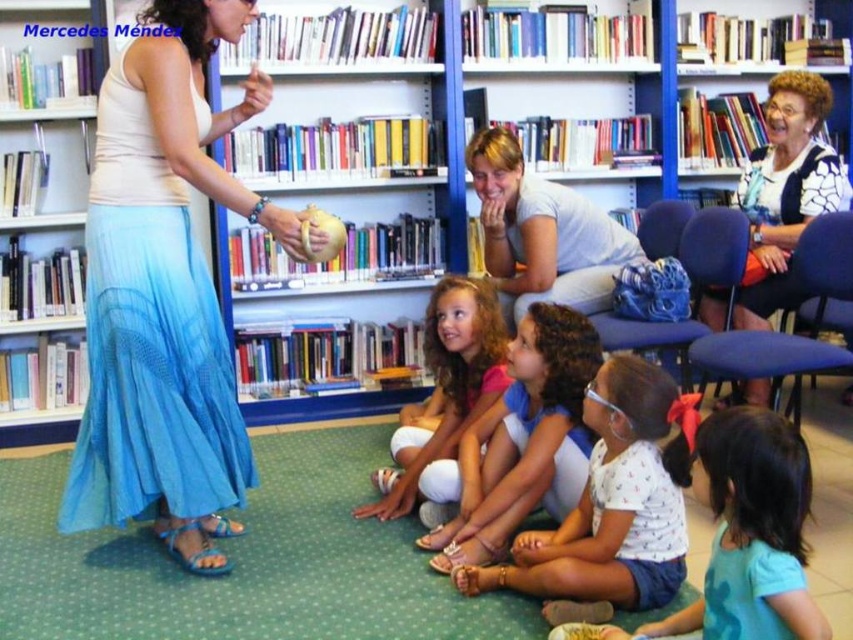
This screenshot has height=640, width=853. Describe the element at coordinates (613, 502) in the screenshot. I see `white cotton shirt at center` at that location.

Who is more distant from viewer, (642, 513) or (798, 157)?

The point (798, 157) is behind.

The image size is (853, 640). What are the coordinates of `white cotton shirt at center` in the screenshot? It's located at (x=613, y=502).

Is white printed blouse at upper right to the right of smooth skin girl at center from the viewer's perspective?

Correct, you'll find white printed blouse at upper right to the right of smooth skin girl at center.

Locate an element on the screen. The height and width of the screenshot is (640, 853). white printed blouse at upper right is located at coordinates (786, 192).

Who is positioned more to the left, light brown skin at center or smooth skin girl at center?

smooth skin girl at center

Does point (540, 378) come behind point (456, 428)?

No.

Which is in front, point (570, 308) or point (460, 406)?

Point (570, 308)

Find the location of a particular element. This screenshot has height=640, width=853. light brown skin at center is located at coordinates click(x=523, y=440).